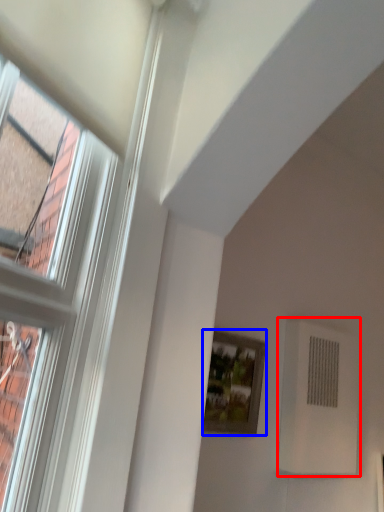
Question: Which object appears closest to the camera in this image, air conditioning (highlighted by a red box) or picture frame (highlighted by a blue box)?

Choices:
 (A) air conditioning
 (B) picture frame

Answer: (B)